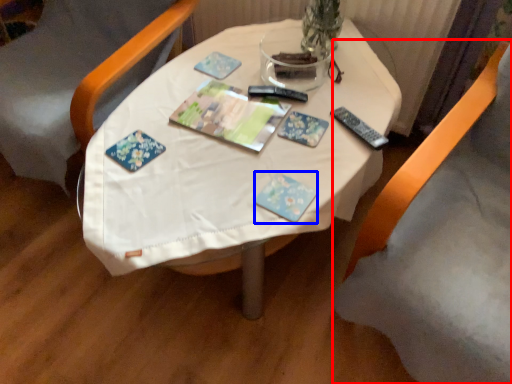
Question: Which of the following is the farthest to the observer, chair (highlighted by a red box) or paperback book (highlighted by a blue box)?

Choices:
 (A) chair
 (B) paperback book

Answer: (B)